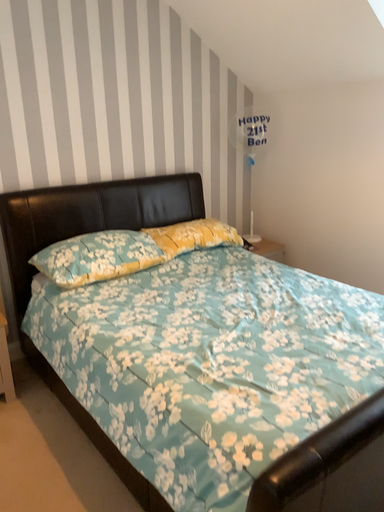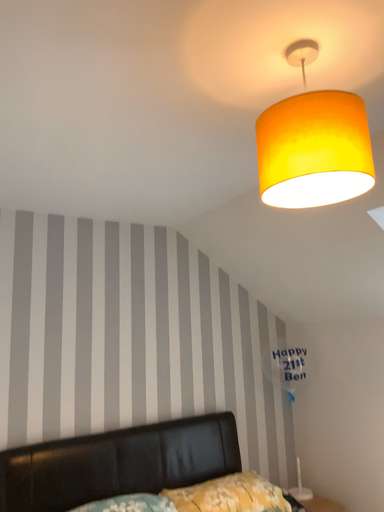
Question: Which way did the camera rotate in the video?

Choices:
 (A) rotated upward
 (B) rotated downward

Answer: (A)